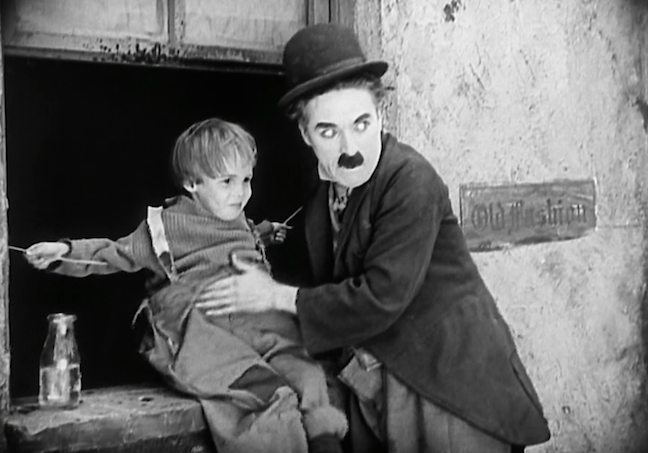
At what (x,y) coordinates should I click in order to perform the action: click on ledge. Please return your answer as a coordinate pair (x, y). Looking at the image, I should click on (152, 405).